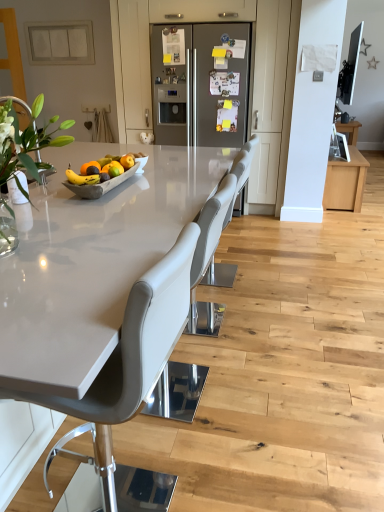
You are a GUI agent. You are given a task and a screenshot of the screen. Output one action in this format:
    pyautogui.click(x=<x>, y=<y>)
    Task: Click on the vacant space behind matte gray chair at center, which is the third chair in back-to-front order
    The height and width of the screenshot is (512, 384).
    Given the screenshot: What is the action you would take?
    pyautogui.click(x=151, y=442)